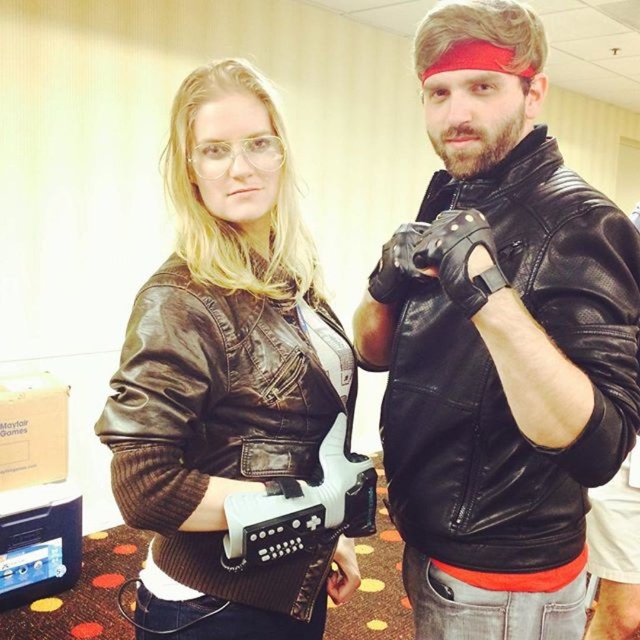
You are a photographer at a cosplay event and need to arrange the two models so that their jackets are positioned correctly according to the original artwork. The original artwork requires the brown leather jacket at center to be positioned to the left of the black leather jacket at center. Are the jackets currently arranged correctly in the image?

The black leather jacket at center is to the right of the brown leather jacket at center, which matches the original artwork requirement. Therefore, the jackets are arranged correctly.

You are a photographer trying to capture both the point at coordinates point [529,104] and point [141,429] in the image. Which point should you focus on first to ensure both are in focus?

You should focus on point [529,104] first because it is closer to the viewer than point [141,429], ensuring both can be in focus.

You are at a cosplay event and need to take a photo of both the black leather jacket at center and the brown leather jacket at center. Since they are positioned close to each other, will you need to adjust your camera angle to capture both jackets fully in the frame?

The black leather jacket at center is in front of the brown leather jacket at center, so adjusting the camera angle slightly backward or widening the frame might be necessary to ensure both jackets are fully visible.